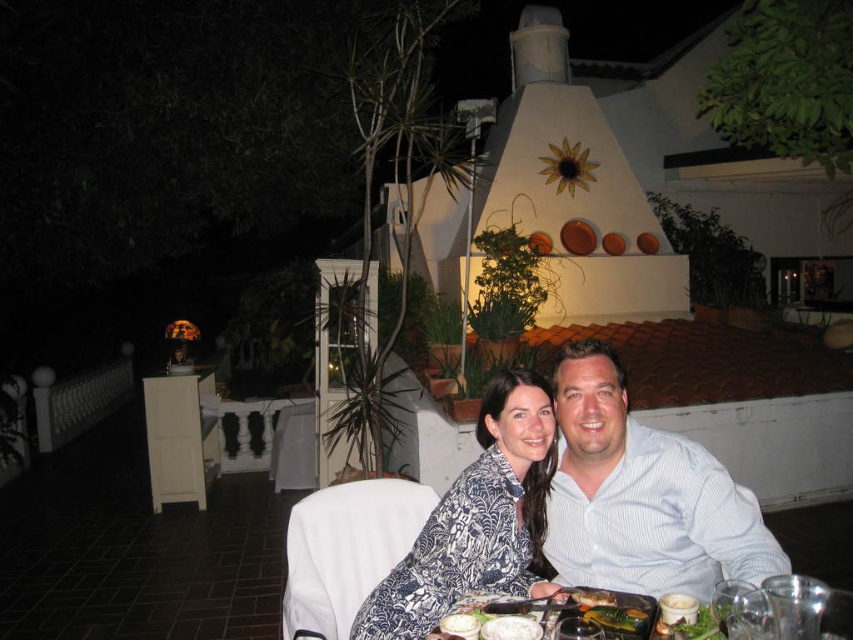
You are standing at the edge of the dining area and want to place a small decorative item between the two points labeled as point (456, 564) and point (628, 618). Which point should you place it closer to in order for it to appear closer to you?

You should place the item closer to point (456, 564) because it is closer to you than point (628, 618), so placing it near that point will make it appear closer.

You are standing at the edge of the dining area and want to walk towards the two people sitting at the table. Which point, point (682, 508) or point (418, 634), would you reach first?

You would reach point (418, 634) first because it is closer to you than point (682, 508), which is behind it.